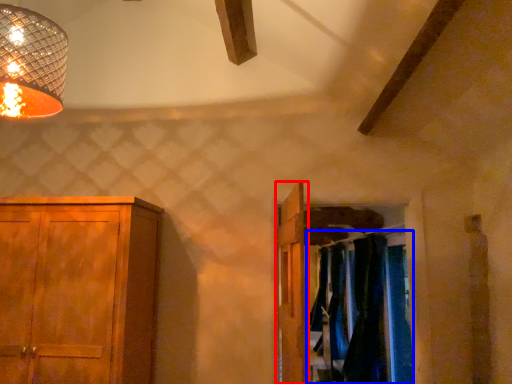
Question: Among these objects, which one is farthest to the camera, door (highlighted by a red box) or laundry (highlighted by a blue box)?

Choices:
 (A) door
 (B) laundry

Answer: (B)